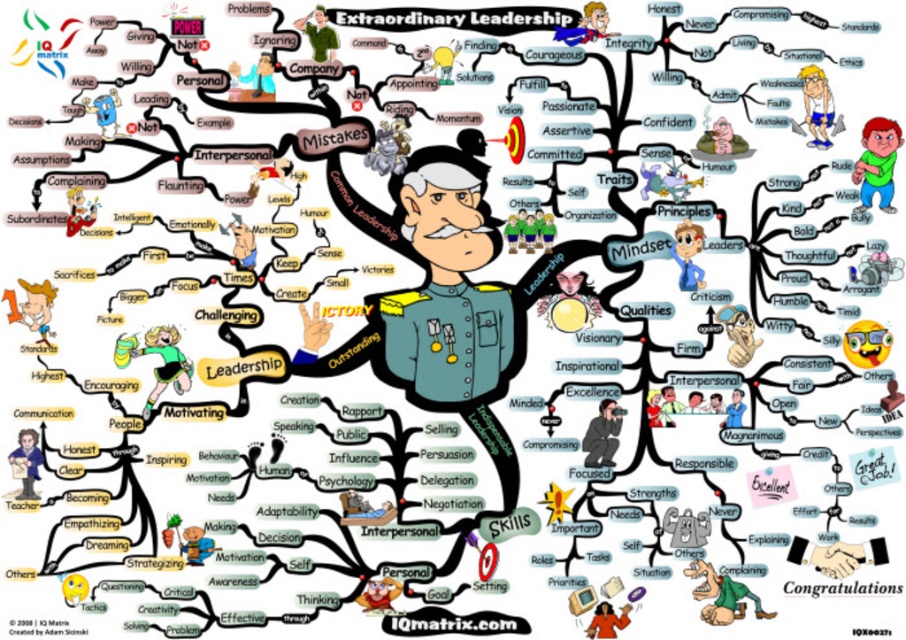
You are an observer analyzing the spatial arrangement of the mind map. The blue shirt at center and the orange fabric person at lower right are two elements in the image. Which of these two elements appears larger in size?

The blue shirt at center is taller than the orange fabric person at lower right, so it appears larger in size.